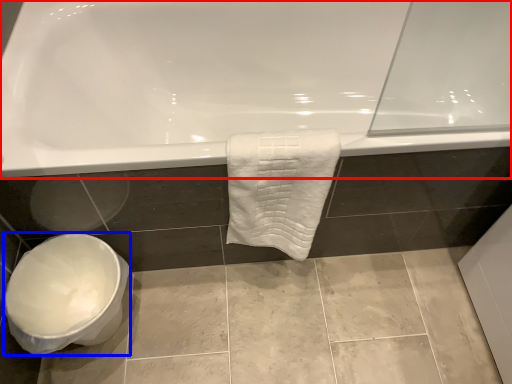
Question: Which object appears farthest to the camera in this image, bathtub (highlighted by a red box) or toilet bowl (highlighted by a blue box)?

Choices:
 (A) bathtub
 (B) toilet bowl

Answer: (B)